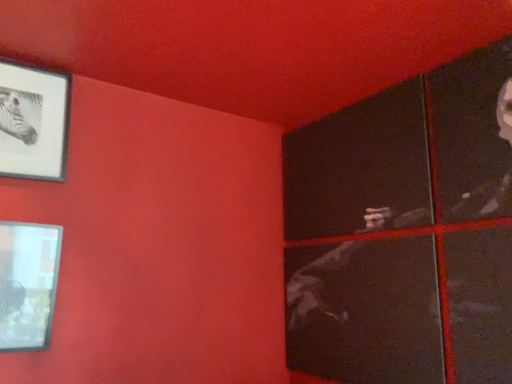
Question: Can you confirm if matte glass picture frame at lower left, which is the second picture frame from top to bottom, is positioned to the left of matte black frame at upper left, the first picture frame positioned from the top?

Choices:
 (A) no
 (B) yes

Answer: (A)

Question: Is matte glass picture frame at lower left, which is the second picture frame from top to bottom, smaller than matte black frame at upper left, the first picture frame positioned from the top?

Choices:
 (A) no
 (B) yes

Answer: (A)

Question: Does matte glass picture frame at lower left, positioned as the first picture frame in bottom-to-top order, come in front of matte black frame at upper left, the first picture frame positioned from the top?

Choices:
 (A) yes
 (B) no

Answer: (A)

Question: Can you confirm if matte glass picture frame at lower left, positioned as the first picture frame in bottom-to-top order, is shorter than matte black frame at upper left, the second picture frame ordered from the bottom?

Choices:
 (A) no
 (B) yes

Answer: (B)

Question: Considering the relative sizes of matte glass picture frame at lower left, which is the second picture frame from top to bottom, and matte black frame at upper left, the first picture frame positioned from the top, in the image provided, is matte glass picture frame at lower left, which is the second picture frame from top to bottom, taller than matte black frame at upper left, the first picture frame positioned from the top,?

Choices:
 (A) no
 (B) yes

Answer: (A)

Question: From the image's perspective, is matte glass picture frame at lower left, which is the second picture frame from top to bottom, beneath matte black frame at upper left, the second picture frame ordered from the bottom?

Choices:
 (A) yes
 (B) no

Answer: (A)

Question: From the image's perspective, is matte black frame at upper left, the second picture frame ordered from the bottom, located above matte glass picture frame at lower left, which is the second picture frame from top to bottom?

Choices:
 (A) yes
 (B) no

Answer: (A)

Question: From a real-world perspective, is matte black frame at upper left, the second picture frame ordered from the bottom, located beneath matte glass picture frame at lower left, which is the second picture frame from top to bottom?

Choices:
 (A) yes
 (B) no

Answer: (B)

Question: Could you tell me if matte black frame at upper left, the second picture frame ordered from the bottom, is turned towards matte glass picture frame at lower left, which is the second picture frame from top to bottom?

Choices:
 (A) no
 (B) yes

Answer: (A)

Question: Considering the relative sizes of matte black frame at upper left, the first picture frame positioned from the top, and matte glass picture frame at lower left, positioned as the first picture frame in bottom-to-top order, in the image provided, is matte black frame at upper left, the first picture frame positioned from the top, bigger than matte glass picture frame at lower left, positioned as the first picture frame in bottom-to-top order,?

Choices:
 (A) no
 (B) yes

Answer: (A)

Question: Is matte black frame at upper left, the second picture frame ordered from the bottom, at the left side of matte glass picture frame at lower left, which is the second picture frame from top to bottom?

Choices:
 (A) no
 (B) yes

Answer: (B)

Question: Is matte black frame at upper left, the first picture frame positioned from the top, in front of matte glass picture frame at lower left, which is the second picture frame from top to bottom?

Choices:
 (A) yes
 (B) no

Answer: (B)

Question: From the image's perspective, relative to matte glass picture frame at lower left, which is the second picture frame from top to bottom, is matte black frame at upper left, the second picture frame ordered from the bottom, above or below?

Choices:
 (A) above
 (B) below

Answer: (A)